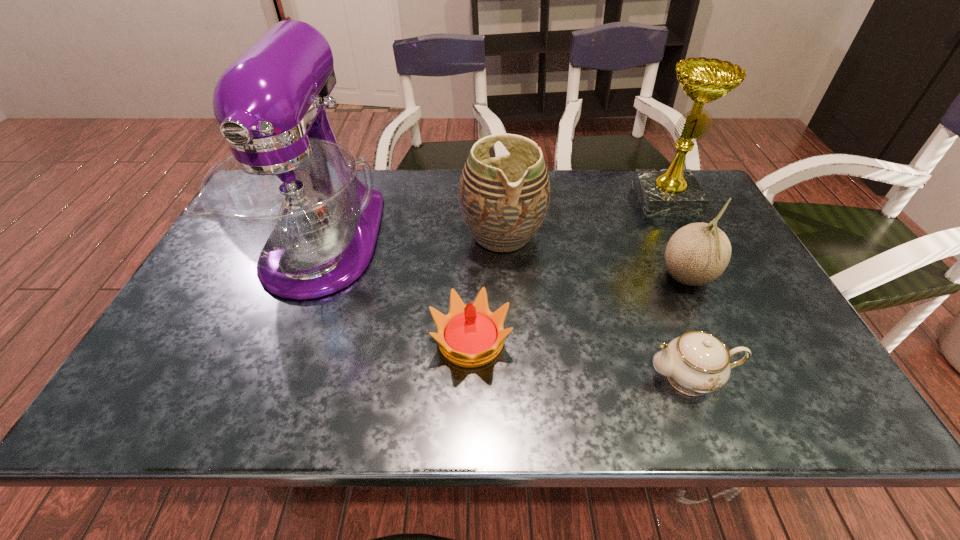
This screenshot has height=540, width=960. I want to click on vacant space that satisfies the following two spatial constraints: 1. at the bowl opening of the crown; 2. on the left side of the mixer, so click(x=285, y=341).